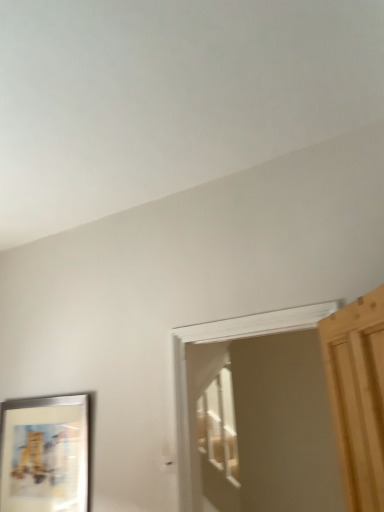
Question: From the image's perspective, is wooden screen door at center under metallic silver picture frame at lower left?

Choices:
 (A) no
 (B) yes

Answer: (A)

Question: Considering the relative sizes of wooden screen door at center and metallic silver picture frame at lower left in the image provided, is wooden screen door at center shorter than metallic silver picture frame at lower left?

Choices:
 (A) no
 (B) yes

Answer: (A)

Question: From the image's perspective, is wooden screen door at center on top of metallic silver picture frame at lower left?

Choices:
 (A) yes
 (B) no

Answer: (A)

Question: Is wooden screen door at center thinner than metallic silver picture frame at lower left?

Choices:
 (A) no
 (B) yes

Answer: (A)

Question: Does wooden screen door at center come behind metallic silver picture frame at lower left?

Choices:
 (A) yes
 (B) no

Answer: (B)

Question: Is metallic silver picture frame at lower left at the back of wooden screen door at center?

Choices:
 (A) no
 (B) yes

Answer: (A)

Question: Is metallic silver picture frame at lower left looking in the opposite direction of wooden screen door at center?

Choices:
 (A) no
 (B) yes

Answer: (A)

Question: From a real-world perspective, is metallic silver picture frame at lower left located beneath wooden screen door at center?

Choices:
 (A) yes
 (B) no

Answer: (A)

Question: Is the depth of metallic silver picture frame at lower left greater than that of wooden screen door at center?

Choices:
 (A) no
 (B) yes

Answer: (B)

Question: Is metallic silver picture frame at lower left smaller than wooden screen door at center?

Choices:
 (A) yes
 (B) no

Answer: (A)

Question: Is metallic silver picture frame at lower left at the left side of wooden screen door at center?

Choices:
 (A) no
 (B) yes

Answer: (B)

Question: Is wooden screen door at center inside metallic silver picture frame at lower left?

Choices:
 (A) yes
 (B) no

Answer: (B)

Question: Considering the positions of point (39, 432) and point (312, 346), is point (39, 432) closer or farther from the camera than point (312, 346)?

Choices:
 (A) farther
 (B) closer

Answer: (B)